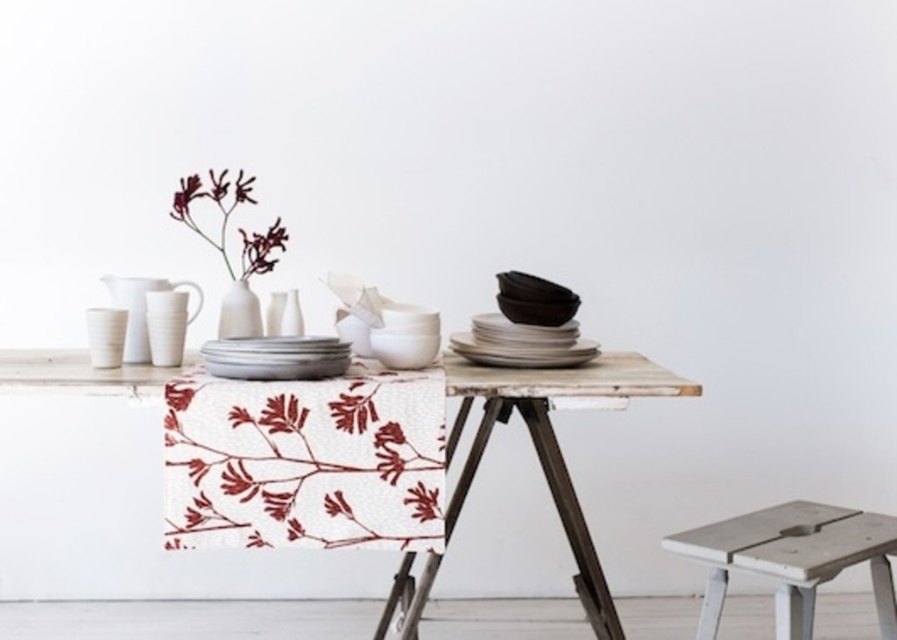
Who is lower down, white matte platter at center or white ceramic vase at left?

white matte platter at center is lower down.

Which is above, white matte platter at center or white ceramic vase at left?

white ceramic vase at left is above.

At what (x,y) coordinates should I click in order to perform the action: click on white matte platter at center. Please return your answer as a coordinate pair (x, y). This screenshot has width=897, height=640. Looking at the image, I should click on (276, 356).

Which is behind, point (401, 385) or point (64, 372)?

Point (64, 372)

Identify the location of white textured tablecloth at center. The height and width of the screenshot is (640, 897). (305, 460).

Identify the location of white textured tablecloth at center. (305, 460).

Is white matte platter at center above matte white vase at upper left?

No, white matte platter at center is not above matte white vase at upper left.

From the picture: Does white matte platter at center have a greater width compared to matte white vase at upper left?

Incorrect, white matte platter at center's width does not surpass matte white vase at upper left's.

Which is behind, point (335, 348) or point (279, 225)?

Point (279, 225)

Where is `white matte platter at center`? The height and width of the screenshot is (640, 897). white matte platter at center is located at coordinates (276, 356).